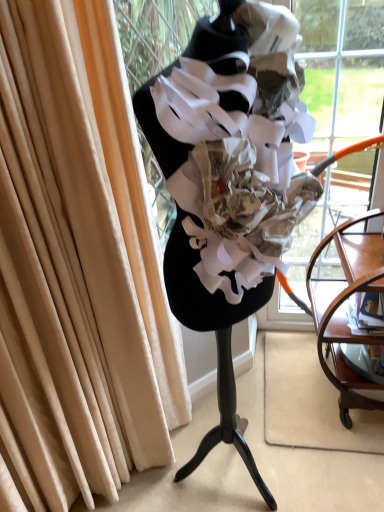
Question: Should I look upward or downward to see transparent glass shop window at center?

Choices:
 (A) up
 (B) down

Answer: (B)

Question: Are transparent glass shop window at center and mahogany wood side table at right beside each other?

Choices:
 (A) yes
 (B) no

Answer: (B)

Question: From the image's perspective, is transparent glass shop window at center over mahogany wood side table at right?

Choices:
 (A) yes
 (B) no

Answer: (A)

Question: Is transparent glass shop window at center at the right side of mahogany wood side table at right?

Choices:
 (A) yes
 (B) no

Answer: (B)

Question: Considering the relative positions of transparent glass shop window at center and mahogany wood side table at right in the image provided, is transparent glass shop window at center in front of mahogany wood side table at right?

Choices:
 (A) yes
 (B) no

Answer: (A)

Question: Does transparent glass shop window at center have a greater height compared to mahogany wood side table at right?

Choices:
 (A) no
 (B) yes

Answer: (B)

Question: Does transparent glass shop window at center appear on the left side of mahogany wood side table at right?

Choices:
 (A) yes
 (B) no

Answer: (A)

Question: Can you confirm if transparent glass shop window at center is smaller than clear glass shelf at lower right?

Choices:
 (A) no
 (B) yes

Answer: (A)

Question: Considering the relative sizes of transparent glass shop window at center and clear glass shelf at lower right in the image provided, is transparent glass shop window at center taller than clear glass shelf at lower right?

Choices:
 (A) no
 (B) yes

Answer: (B)

Question: From a real-world perspective, is transparent glass shop window at center on top of clear glass shelf at lower right?

Choices:
 (A) no
 (B) yes

Answer: (B)

Question: Is transparent glass shop window at center wider than clear glass shelf at lower right?

Choices:
 (A) yes
 (B) no

Answer: (A)

Question: Considering the relative positions of transparent glass shop window at center and clear glass shelf at lower right in the image provided, is transparent glass shop window at center in front of clear glass shelf at lower right?

Choices:
 (A) yes
 (B) no

Answer: (A)

Question: From the image's perspective, is transparent glass shop window at center on clear glass shelf at lower right?

Choices:
 (A) no
 (B) yes

Answer: (B)

Question: Is beige velvet curtain at left further to camera compared to transparent glass shop window at center?

Choices:
 (A) yes
 (B) no

Answer: (A)